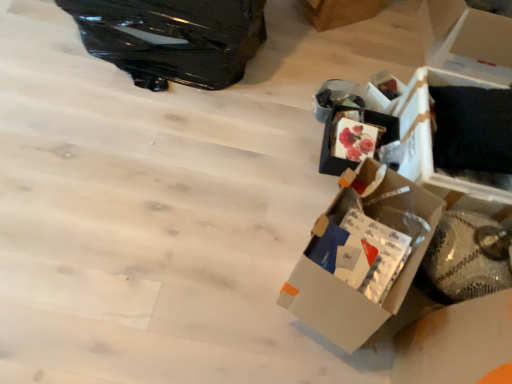
What do you see at coordinates (432, 150) in the screenshot? The width and height of the screenshot is (512, 384). I see `black cardboard box at right, arranged as the 2th storage box when viewed from the back` at bounding box center [432, 150].

In order to face white cardboard box at upper right, arranged as the second storage box when viewed from the front, should I rotate leftwards or rightwards?

To align with it, rotate right about 17.444°.

Where is `white cardboard box at center-right`? The image size is (512, 384). white cardboard box at center-right is located at coordinates (362, 255).

The width and height of the screenshot is (512, 384). In order to click on white cardboard box at upper right, placed as the second cardboard box when sorted from left to right in this screenshot , I will do `click(467, 40)`.

The width and height of the screenshot is (512, 384). Find the location of `glossy black suitcase at upper left`. glossy black suitcase at upper left is located at coordinates (172, 38).

Is point (443, 62) farther from camera compared to point (370, 257)?

Yes, point (443, 62) is farther from viewer.

Is white cardboard box at upper right, placed as the second cardboard box when sorted from left to right, smaller than white cardboard box at center-right?

No, white cardboard box at upper right, placed as the second cardboard box when sorted from left to right, is not smaller than white cardboard box at center-right.

From the picture: Is white cardboard box at upper right, placed as the second cardboard box when sorted from left to right, oriented away from white cardboard box at center-right?

No, white cardboard box at upper right, placed as the second cardboard box when sorted from left to right,'s orientation is not away from white cardboard box at center-right.

From a real-world perspective, is white cardboard box at upper right, the first cardboard box when ordered from right to left, on top of white cardboard box at center-right?

Yes, from a real-world perspective, white cardboard box at upper right, the first cardboard box when ordered from right to left, is above white cardboard box at center-right.

Does glossy black suitcase at upper left have a lesser width compared to white cardboard box at upper right, placed as the second cardboard box when sorted from right to left?

In fact, glossy black suitcase at upper left might be wider than white cardboard box at upper right, placed as the second cardboard box when sorted from right to left.

From the image's perspective, which one is positioned lower, glossy black suitcase at upper left or white cardboard box at upper right, which is the first cardboard box from left to right?

glossy black suitcase at upper left is shown below in the image.

Does glossy black suitcase at upper left have a greater height compared to white cardboard box at upper right, placed as the second cardboard box when sorted from right to left?

Indeed, glossy black suitcase at upper left has a greater height compared to white cardboard box at upper right, placed as the second cardboard box when sorted from right to left.

Is glossy black suitcase at upper left to the right of white cardboard box at upper right, which is the first cardboard box from left to right, from the viewer's perspective?

In fact, glossy black suitcase at upper left is to the left of white cardboard box at upper right, which is the first cardboard box from left to right.

Does glossy black suitcase at upper left have a lesser width compared to white cardboard box at upper right, placed as the second cardboard box when sorted from left to right?

Incorrect, the width of glossy black suitcase at upper left is not less than that of white cardboard box at upper right, placed as the second cardboard box when sorted from left to right.

Is glossy black suitcase at upper left oriented towards white cardboard box at upper right, the first cardboard box when ordered from right to left?

No, glossy black suitcase at upper left is not oriented towards white cardboard box at upper right, the first cardboard box when ordered from right to left.

From a real-world perspective, is glossy black suitcase at upper left physically above white cardboard box at upper right, the first cardboard box when ordered from right to left?

Yes, from a real-world perspective, glossy black suitcase at upper left is above white cardboard box at upper right, the first cardboard box when ordered from right to left.

Do you think glossy black suitcase at upper left is within white cardboard box at upper right, placed as the second cardboard box when sorted from left to right, or outside of it?

glossy black suitcase at upper left is outside white cardboard box at upper right, placed as the second cardboard box when sorted from left to right.

Which object is more forward, white cardboard box at upper right, arranged as the 1th storage box when viewed from the back, or white cardboard box at upper right, the first cardboard box when ordered from right to left?

white cardboard box at upper right, the first cardboard box when ordered from right to left, is closer to the camera.

Does white cardboard box at upper right, arranged as the second storage box when viewed from the front, touch white cardboard box at upper right, the first cardboard box when ordered from right to left?

white cardboard box at upper right, arranged as the second storage box when viewed from the front, and white cardboard box at upper right, the first cardboard box when ordered from right to left, are clearly separated.

In the scene shown: Which object is further away from the camera, white cardboard box at center-right or white cardboard box at upper right, placed as the second cardboard box when sorted from right to left?

Positioned behind is white cardboard box at upper right, placed as the second cardboard box when sorted from right to left.

In the scene shown: Which of these two, white cardboard box at center-right or white cardboard box at upper right, placed as the second cardboard box when sorted from right to left, is bigger?

white cardboard box at center-right.

Measure the distance from white cardboard box at center-right to white cardboard box at upper right, placed as the second cardboard box when sorted from right to left.

1.34 meters.

Is there a large distance between white cardboard box at center-right and white cardboard box at upper right, which is the first cardboard box from left to right?

That's right, there is a large distance between white cardboard box at center-right and white cardboard box at upper right, which is the first cardboard box from left to right.

Considering the relative sizes of glossy black suitcase at upper left and black cardboard box at right, placed as the 1th storage box when sorted from front to back, in the image provided, is glossy black suitcase at upper left taller than black cardboard box at right, placed as the 1th storage box when sorted from front to back,?

Indeed, glossy black suitcase at upper left has a greater height compared to black cardboard box at right, placed as the 1th storage box when sorted from front to back.

Where is `storage box lying in front of the glossy black suitcase at upper left`? This screenshot has width=512, height=384. storage box lying in front of the glossy black suitcase at upper left is located at coordinates (432, 150).

Which object is positioned more to the left, glossy black suitcase at upper left or black cardboard box at right, arranged as the 2th storage box when viewed from the back?

Positioned to the left is glossy black suitcase at upper left.

Is black cardboard box at right, placed as the 1th storage box when sorted from front to back, further to the viewer compared to white cardboard box at upper right, placed as the second cardboard box when sorted from right to left?

No, black cardboard box at right, placed as the 1th storage box when sorted from front to back, is in front of white cardboard box at upper right, placed as the second cardboard box when sorted from right to left.

Is black cardboard box at right, placed as the 1th storage box when sorted from front to back, oriented away from white cardboard box at upper right, placed as the second cardboard box when sorted from right to left?

black cardboard box at right, placed as the 1th storage box when sorted from front to back, does not have its back to white cardboard box at upper right, placed as the second cardboard box when sorted from right to left.

Which point is more distant from viewer, (465, 208) or (361, 8)?

The point (361, 8) is farther.

You are a GUI agent. You are given a task and a screenshot of the screen. Output one action in this format:
    pyautogui.click(x=<x>, y=<y>)
    Task: Click on the box on the left of the white cardboard box at upper right, placed as the second cardboard box when sorted from left to right
    
    Given the screenshot: What is the action you would take?
    pyautogui.click(x=362, y=255)

I want to click on the 1st cardboard box to the right of the glossy black suitcase at upper left, starting your count from the anchor, so click(x=339, y=12).

Estimate the real-world distances between objects in this image. Which object is further from white cardboard box at upper right, which is the first cardboard box from left to right, white cardboard box at upper right, arranged as the 1th storage box when viewed from the back, or white cardboard box at upper right, the first cardboard box when ordered from right to left?

white cardboard box at upper right, the first cardboard box when ordered from right to left, is positioned further to the anchor white cardboard box at upper right, which is the first cardboard box from left to right.

From the image, which object appears to be farther from white cardboard box at center-right, black cardboard box at right, arranged as the 2th storage box when viewed from the back, or glossy black suitcase at upper left?

glossy black suitcase at upper left is positioned further to the anchor white cardboard box at center-right.

Which object lies further to the anchor point white cardboard box at center-right, glossy black suitcase at upper left or white cardboard box at upper right, placed as the second cardboard box when sorted from right to left?

The object further to white cardboard box at center-right is white cardboard box at upper right, placed as the second cardboard box when sorted from right to left.

Consider the image. Which object lies nearer to the anchor point black cardboard box at right, arranged as the 2th storage box when viewed from the back, white cardboard box at upper right, placed as the second cardboard box when sorted from left to right, or glossy black suitcase at upper left?

white cardboard box at upper right, placed as the second cardboard box when sorted from left to right, lies closer to black cardboard box at right, arranged as the 2th storage box when viewed from the back, than the other object.

Looking at the image, which one is located closer to white cardboard box at upper right, which is the first cardboard box from left to right, white cardboard box at upper right, arranged as the second storage box when viewed from the front, or white cardboard box at center-right?

white cardboard box at upper right, arranged as the second storage box when viewed from the front.

Estimate the real-world distances between objects in this image. Which object is closer to black cardboard box at right, placed as the 1th storage box when sorted from front to back, white cardboard box at upper right, arranged as the second storage box when viewed from the front, or white cardboard box at upper right, placed as the second cardboard box when sorted from right to left?

white cardboard box at upper right, arranged as the second storage box when viewed from the front, is closer to black cardboard box at right, placed as the 1th storage box when sorted from front to back.

Based on the photo, which object lies nearer to the anchor point white cardboard box at center-right, black cardboard box at right, arranged as the 2th storage box when viewed from the back, or white cardboard box at upper right, placed as the second cardboard box when sorted from right to left?

black cardboard box at right, arranged as the 2th storage box when viewed from the back, is closer to white cardboard box at center-right.

Looking at the image, which one is located further to white cardboard box at upper right, arranged as the 1th storage box when viewed from the back, glossy black suitcase at upper left or white cardboard box at upper right, placed as the second cardboard box when sorted from right to left?

Among the two, glossy black suitcase at upper left is located further to white cardboard box at upper right, arranged as the 1th storage box when viewed from the back.

You are a GUI agent. You are given a task and a screenshot of the screen. Output one action in this format:
    pyautogui.click(x=<x>, y=<y>)
    Task: Click on the storage box that lies between white cardboard box at upper right, the first cardboard box when ordered from right to left, and black cardboard box at right, placed as the 1th storage box when sorted from front to back, from top to bottom
    This screenshot has height=384, width=512.
    Given the screenshot: What is the action you would take?
    pyautogui.click(x=383, y=92)

The width and height of the screenshot is (512, 384). In order to click on storage box between white cardboard box at upper right, which is the first cardboard box from left to right, and black cardboard box at right, arranged as the 2th storage box when viewed from the back, in the vertical direction in this screenshot , I will do `click(383, 92)`.

Identify the location of cardboard box between glossy black suitcase at upper left and white cardboard box at upper right, the first cardboard box when ordered from right to left, from left to right. Image resolution: width=512 pixels, height=384 pixels. (339, 12).

At what (x,y) coordinates should I click in order to perform the action: click on box between glossy black suitcase at upper left and black cardboard box at right, arranged as the 2th storage box when viewed from the back. Please return your answer as a coordinate pair (x, y). Image resolution: width=512 pixels, height=384 pixels. Looking at the image, I should click on (362, 255).